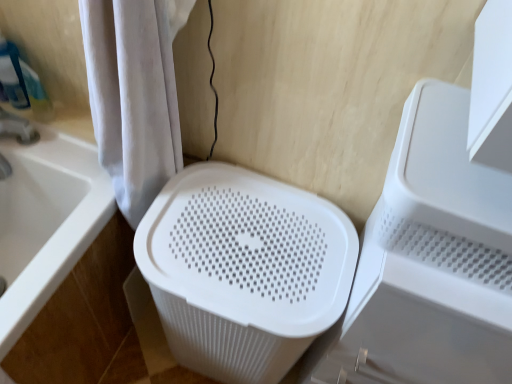
Question: Is white plastic bathtub at lower left oriented towards velvet white shower curtain at left?

Choices:
 (A) yes
 (B) no

Answer: (B)

Question: Is white plastic bathtub at lower left not inside velvet white shower curtain at left?

Choices:
 (A) yes
 (B) no

Answer: (A)

Question: Can you confirm if white plastic bathtub at lower left is wider than velvet white shower curtain at left?

Choices:
 (A) yes
 (B) no

Answer: (A)

Question: From the image's perspective, is white plastic bathtub at lower left on top of velvet white shower curtain at left?

Choices:
 (A) no
 (B) yes

Answer: (A)

Question: Does white plastic bathtub at lower left have a greater height compared to velvet white shower curtain at left?

Choices:
 (A) yes
 (B) no

Answer: (A)

Question: Is white plastic basket at center spatially inside white plastic laundry basket at center, or outside of it?

Choices:
 (A) outside
 (B) inside

Answer: (A)

Question: From a real-world perspective, is white plastic basket at center above or below white plastic laundry basket at center?

Choices:
 (A) below
 (B) above

Answer: (B)

Question: Is white plastic basket at center to the left or to the right of white plastic laundry basket at center in the image?

Choices:
 (A) right
 (B) left

Answer: (A)

Question: From the image's perspective, is white plastic basket at center positioned above or below white plastic laundry basket at center?

Choices:
 (A) above
 (B) below

Answer: (B)

Question: In the image, is white plastic laundry basket at center on the left side or the right side of white plastic basket at center?

Choices:
 (A) left
 (B) right

Answer: (A)

Question: Does point (201, 292) appear closer or farther from the camera than point (470, 218)?

Choices:
 (A) closer
 (B) farther

Answer: (B)

Question: Based on their sizes in the image, would you say white plastic laundry basket at center is bigger or smaller than white plastic basket at center?

Choices:
 (A) big
 (B) small

Answer: (A)

Question: Is white plastic laundry basket at center in front of or behind white plastic basket at center in the image?

Choices:
 (A) front
 (B) behind

Answer: (B)

Question: Based on their sizes in the image, would you say white plastic bathtub at lower left is bigger or smaller than white plastic basket at center?

Choices:
 (A) big
 (B) small

Answer: (A)

Question: From a real-world perspective, relative to white plastic basket at center, is white plastic bathtub at lower left vertically above or below?

Choices:
 (A) below
 (B) above

Answer: (A)